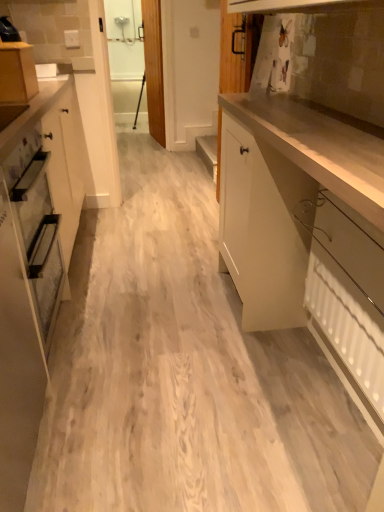
Question: From the image's perspective, is matte wood cabinet at upper left, which appears as the first cabinetry when viewed from the left, under white glossy cabinet at left, the 2th cabinetry positioned from the right?

Choices:
 (A) no
 (B) yes

Answer: (A)

Question: Could white glossy cabinet at left, the 2th cabinetry positioned from the right, be considered to be inside matte wood cabinet at upper left, which appears as the first cabinetry when viewed from the left?

Choices:
 (A) yes
 (B) no

Answer: (B)

Question: From a real-world perspective, is matte wood cabinet at upper left, which is counted as the third cabinetry, starting from the right, located higher than white glossy cabinet at left, the 2th cabinetry positioned from the right?

Choices:
 (A) no
 (B) yes

Answer: (B)

Question: From a real-world perspective, is matte wood cabinet at upper left, which is counted as the third cabinetry, starting from the right, beneath white glossy cabinet at left, the 2th cabinetry when ordered from left to right?

Choices:
 (A) no
 (B) yes

Answer: (A)

Question: Is the position of matte wood cabinet at upper left, which appears as the first cabinetry when viewed from the left, less distant than that of white glossy cabinet at left, the 2th cabinetry when ordered from left to right?

Choices:
 (A) yes
 (B) no

Answer: (B)

Question: Considering the relative positions of matte wood cabinet at upper left, which is counted as the third cabinetry, starting from the right, and white glossy cabinet at left, the 2th cabinetry when ordered from left to right, in the image provided, is matte wood cabinet at upper left, which is counted as the third cabinetry, starting from the right, to the left of white glossy cabinet at left, the 2th cabinetry when ordered from left to right, from the viewer's perspective?

Choices:
 (A) yes
 (B) no

Answer: (A)

Question: Does white glossy cabinet at left, the 2th cabinetry positioned from the right, appear on the right side of glossy white cabinet at right, the 3th cabinetry positioned from the left?

Choices:
 (A) no
 (B) yes

Answer: (A)

Question: Are white glossy cabinet at left, the 2th cabinetry when ordered from left to right, and glossy white cabinet at right, the 3th cabinetry positioned from the left, making contact?

Choices:
 (A) yes
 (B) no

Answer: (B)

Question: Would you say glossy white cabinet at right, which appears as the first cabinetry when viewed from the right, is part of white glossy cabinet at left, the 2th cabinetry positioned from the right,'s contents?

Choices:
 (A) no
 (B) yes

Answer: (A)

Question: Is white glossy cabinet at left, the 2th cabinetry positioned from the right, facing away from glossy white cabinet at right, the 3th cabinetry positioned from the left?

Choices:
 (A) yes
 (B) no

Answer: (B)

Question: Considering the relative sizes of white glossy cabinet at left, the 2th cabinetry when ordered from left to right, and glossy white cabinet at right, the 3th cabinetry positioned from the left, in the image provided, is white glossy cabinet at left, the 2th cabinetry when ordered from left to right, thinner than glossy white cabinet at right, the 3th cabinetry positioned from the left,?

Choices:
 (A) no
 (B) yes

Answer: (B)

Question: Is white glossy cabinet at left, the 2th cabinetry positioned from the right, smaller than glossy white cabinet at right, the 3th cabinetry positioned from the left?

Choices:
 (A) no
 (B) yes

Answer: (B)

Question: Is glossy white cabinet at right, which appears as the first cabinetry when viewed from the right, not within white glossy cabinet at left, the 2th cabinetry when ordered from left to right?

Choices:
 (A) no
 (B) yes

Answer: (B)